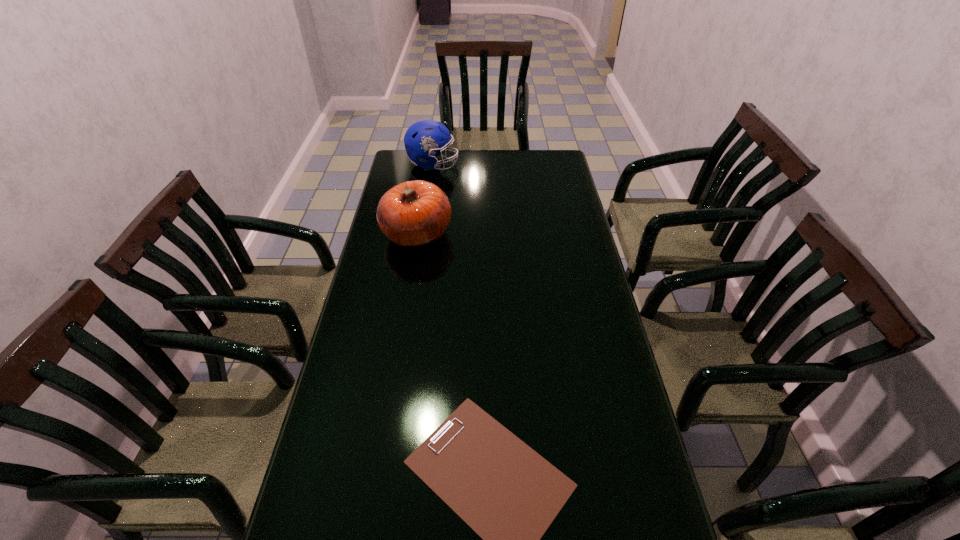
In order to click on football helmet in this screenshot , I will do click(421, 140).

Locate an element on the screen. This screenshot has width=960, height=540. pumpkin is located at coordinates (414, 213).

Where is `free region located on the face guard of the football helmet`? The width and height of the screenshot is (960, 540). free region located on the face guard of the football helmet is located at coordinates click(493, 164).

Where is `free space located on the right of the second farthest object`? free space located on the right of the second farthest object is located at coordinates (468, 233).

Identify the location of object that is at the far edge. The width and height of the screenshot is (960, 540). (421, 140).

Locate an element on the screen. The height and width of the screenshot is (540, 960). football helmet at the left edge is located at coordinates click(x=421, y=140).

Identify the location of pumpkin located at the left edge. (414, 213).

Image resolution: width=960 pixels, height=540 pixels. I want to click on object at the far left corner, so click(x=421, y=140).

Image resolution: width=960 pixels, height=540 pixels. Identify the location of free region at the far edge of the desktop. (444, 149).

In the image, there is a desktop. Where is `vacant region at the left edge`? The height and width of the screenshot is (540, 960). vacant region at the left edge is located at coordinates (316, 460).